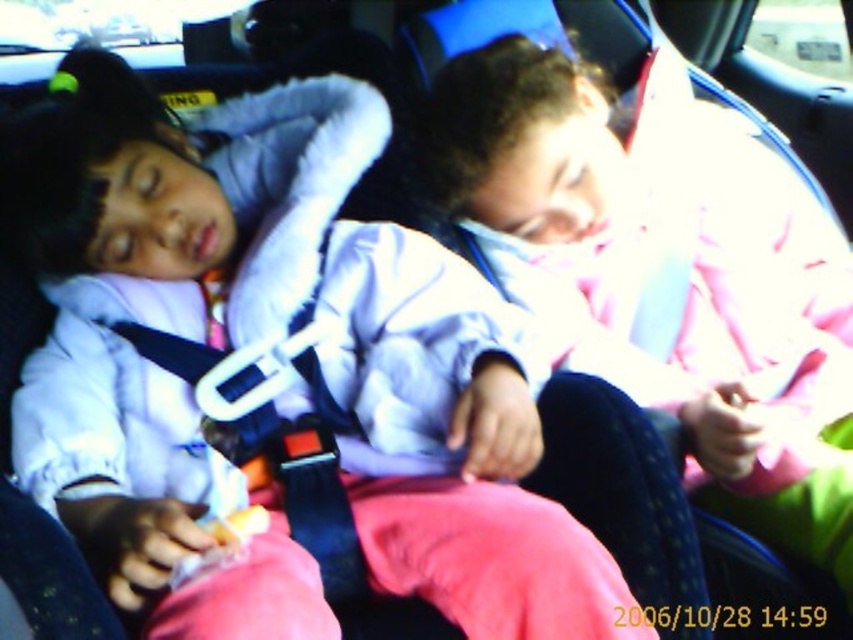
You are a driver who just noticed two children sleeping in the backseat of your car. You need to ensure their safety before continuing the drive. The white matte shirt at center is represented by point (142, 356). Can you confirm if the white matte shirt at center is positioned between the two children?

The white matte shirt at center is represented by point (142, 356). Since the shirt is at the center point between the two children, it is positioned between them.

You are a safety inspector checking the car seats for two children. You notice the white matte shirt at center and the pink fabric at center. Which object is positioned closer to the front of the car?

The white matte shirt at center is closer to the viewer than the pink fabric at center, so the white matte shirt at center is positioned closer to the front of the car.